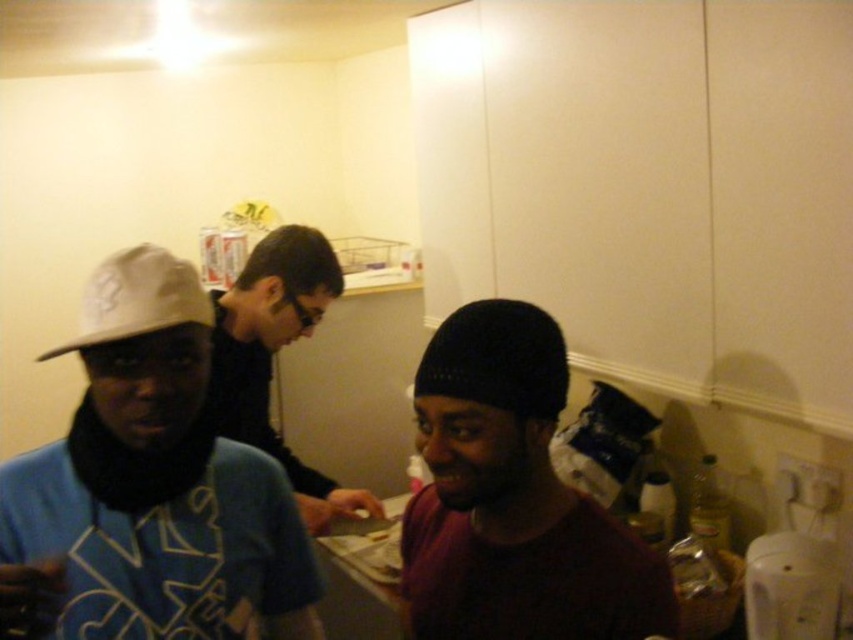
Question: Is white matte cap at upper left to the left of dark knit cap at center from the viewer's perspective?

Choices:
 (A) no
 (B) yes

Answer: (B)

Question: Considering the real-world distances, which object is farthest from the black matte shirt at center?

Choices:
 (A) white matte cap at upper left
 (B) black knit cap at center
 (C) white matte baseball cap at upper left

Answer: (B)

Question: Does black knit cap at center have a smaller size compared to white matte baseball cap at upper left?

Choices:
 (A) yes
 (B) no

Answer: (A)

Question: Does white matte cap at upper left come behind black matte shirt at center?

Choices:
 (A) no
 (B) yes

Answer: (A)

Question: Which of the following is the closest to the observer?

Choices:
 (A) (149, 449)
 (B) (79, 346)
 (C) (300, 506)
 (D) (488, 323)

Answer: (B)

Question: Which point appears farthest from the camera in this image?

Choices:
 (A) coord(112,289)
 (B) coord(498,609)
 (C) coord(258,280)

Answer: (C)